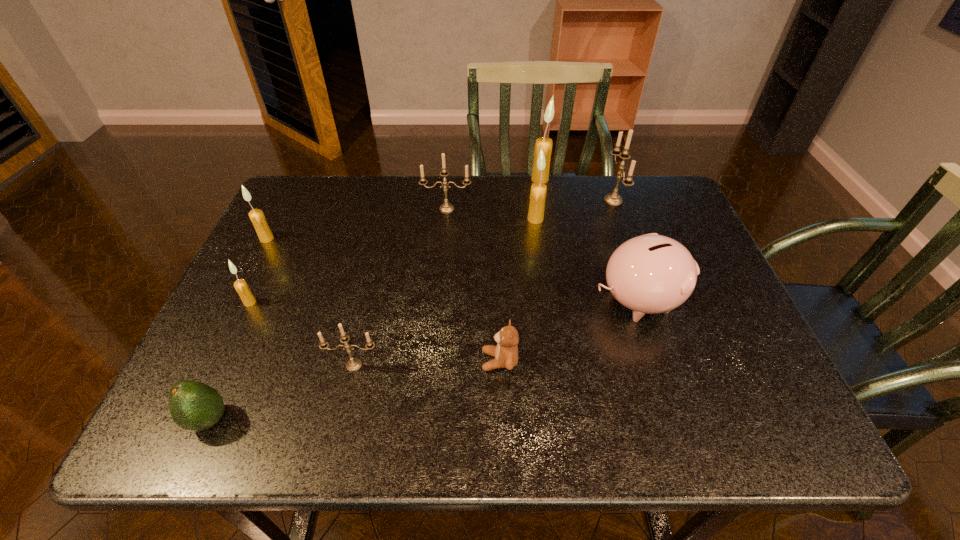
You are a GUI agent. You are given a task and a screenshot of the screen. Output one action in this format:
    pyautogui.click(x=<x>, y=<y>)
    Task: Click on the avocado at the left edge
    
    Given the screenshot: What is the action you would take?
    tap(194, 406)

Locate an element on the screen. This screenshot has height=540, width=960. object at the right edge is located at coordinates (649, 274).

Find the location of `object that is at the near left corner`. object that is at the near left corner is located at coordinates (194, 406).

Where is `vacant region at the far edge`? This screenshot has width=960, height=540. vacant region at the far edge is located at coordinates (481, 209).

The image size is (960, 540). I want to click on free spot at the near edge of the desktop, so [490, 408].

Find the location of a particular element. vacant space at the left edge of the desktop is located at coordinates (225, 322).

At what (x,y) coordinates should I click in order to perform the action: click on vacant space at the right edge of the desktop. Please return your answer as a coordinate pair (x, y). This screenshot has width=960, height=540. Looking at the image, I should click on (738, 343).

You are a GUI agent. You are given a task and a screenshot of the screen. Output one action in this format:
    pyautogui.click(x=<x>, y=<y>)
    Task: Click on the vacant space at the far left corner of the desktop
    The image size is (960, 540).
    Given the screenshot: What is the action you would take?
    pyautogui.click(x=324, y=192)

Where is `vacant space at the near right corner of the desktop`? The image size is (960, 540). vacant space at the near right corner of the desktop is located at coordinates (720, 414).

The image size is (960, 540). I want to click on vacant point located between the rightmost candle and the tallest object, so click(x=577, y=190).